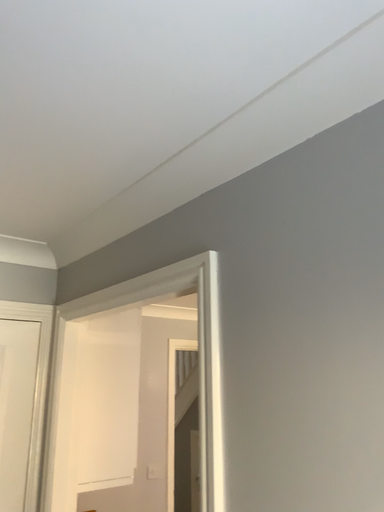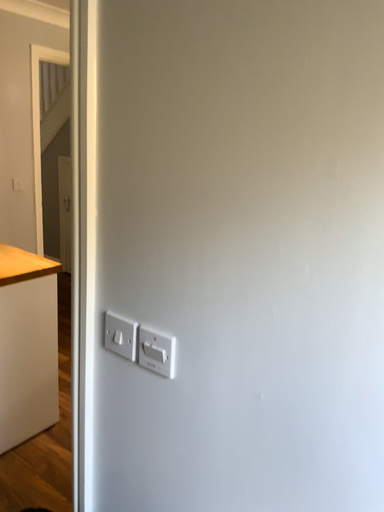
Question: Which way did the camera rotate in the video?

Choices:
 (A) rotated left
 (B) rotated right

Answer: (B)